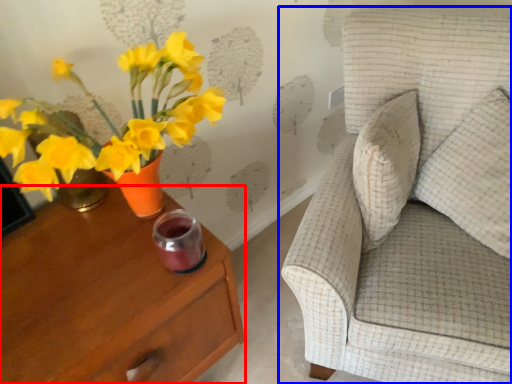
Question: Which point is further to the camera, nightstand (highlighted by a red box) or chair (highlighted by a blue box)?

Choices:
 (A) nightstand
 (B) chair

Answer: (A)